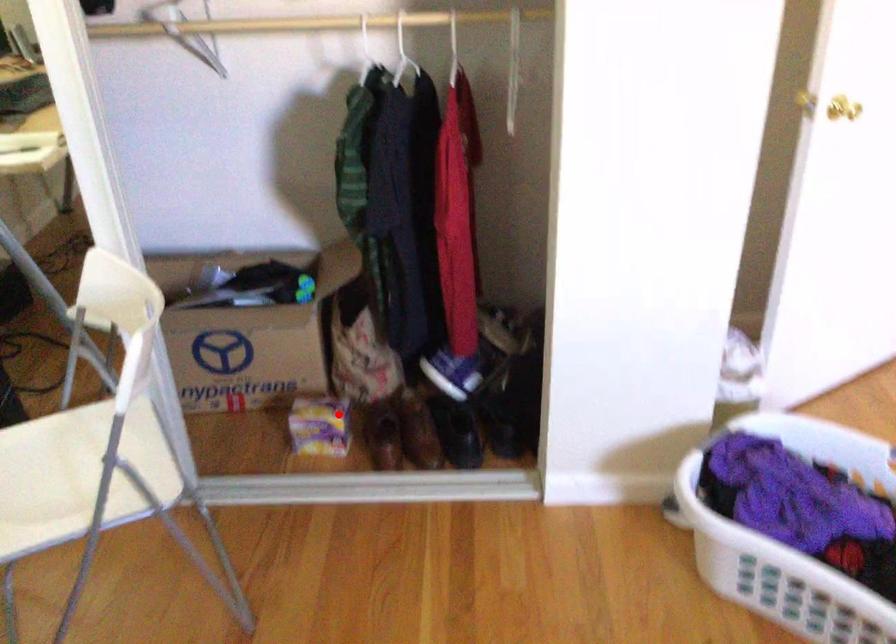
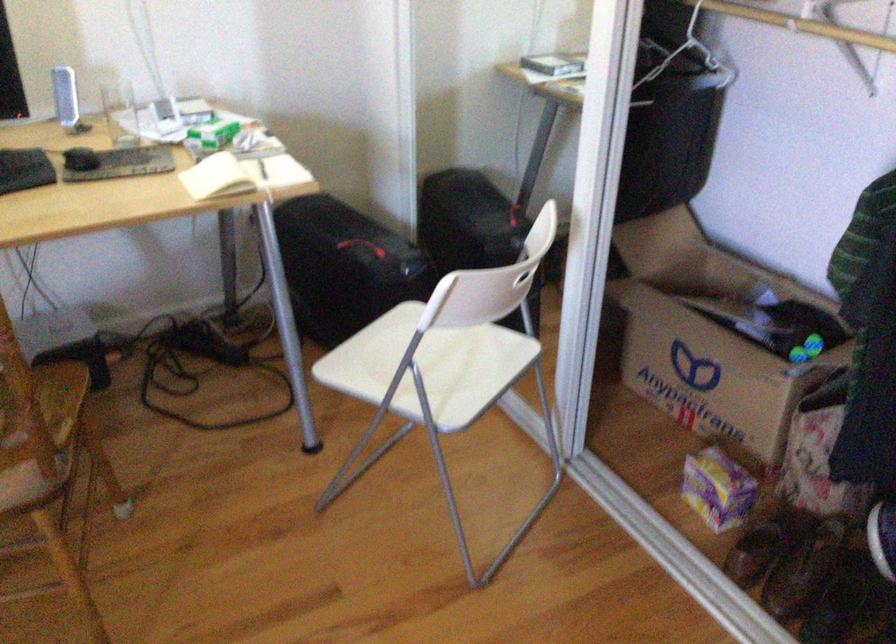
Question: I am providing you with two images of the same scene from different viewpoints. A red point is shown in image1. For the corresponding object point in image2, is it positioned nearer or farther from the camera?

Choices:
 (A) Nearer
 (B) Farther

Answer: (A)